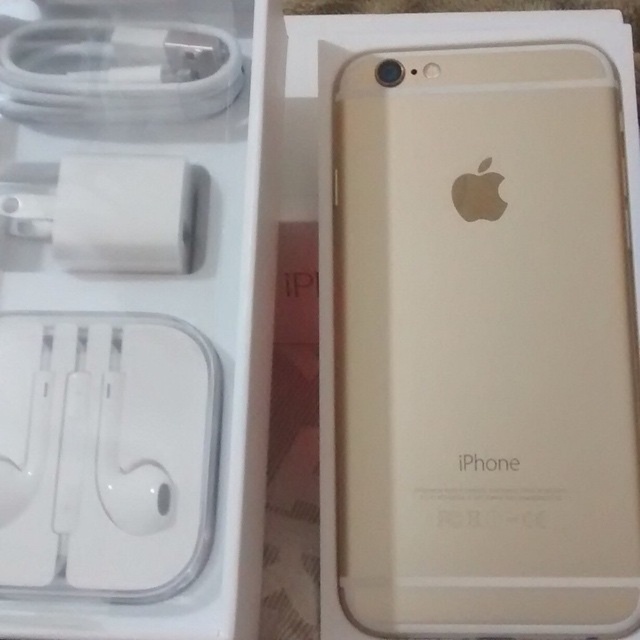
What do you see at coordinates (484, 344) in the screenshot? I see `gold matte iphone at center` at bounding box center [484, 344].

The width and height of the screenshot is (640, 640). I want to click on gold matte iphone at center, so click(x=484, y=344).